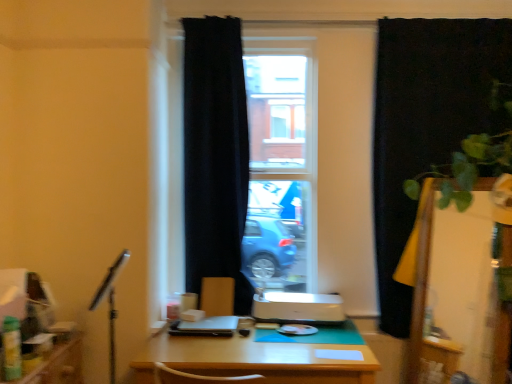
Question: Is point (230, 281) closer or farther from the camera than point (224, 140)?

Choices:
 (A) closer
 (B) farther

Answer: (A)

Question: Which is correct: matte brown armchair at center is inside black fabric curtain at center, which is counted as the 1th curtain, starting from the left, or outside of it?

Choices:
 (A) inside
 (B) outside

Answer: (A)

Question: Which object is positioned closest to the wooden desk at center?

Choices:
 (A) matte brown armchair at center
 (B) transparent glass window at center
 (C) black matte curtain at right, arranged as the 2th curtain when viewed from the left
 (D) transparent glass screen door at right
 (E) green leafy plant at right

Answer: (A)

Question: Which of these objects is positioned closest to the transparent glass window at center?

Choices:
 (A) satin black laptop at center
 (B) black matte curtain at right, arranged as the 2th curtain when viewed from the left
 (C) matte brown armchair at center
 (D) wooden desk at center
 (E) green leafy plant at right

Answer: (B)